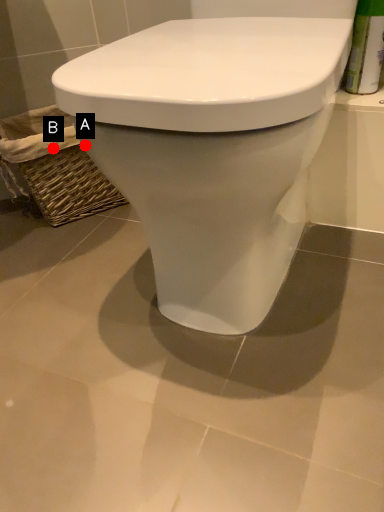
Question: Two points are circled on the image, labeled by A and B beside each circle. Which point is farther from the camera taking this photo?

Choices:
 (A) A is further
 (B) B is further

Answer: (B)